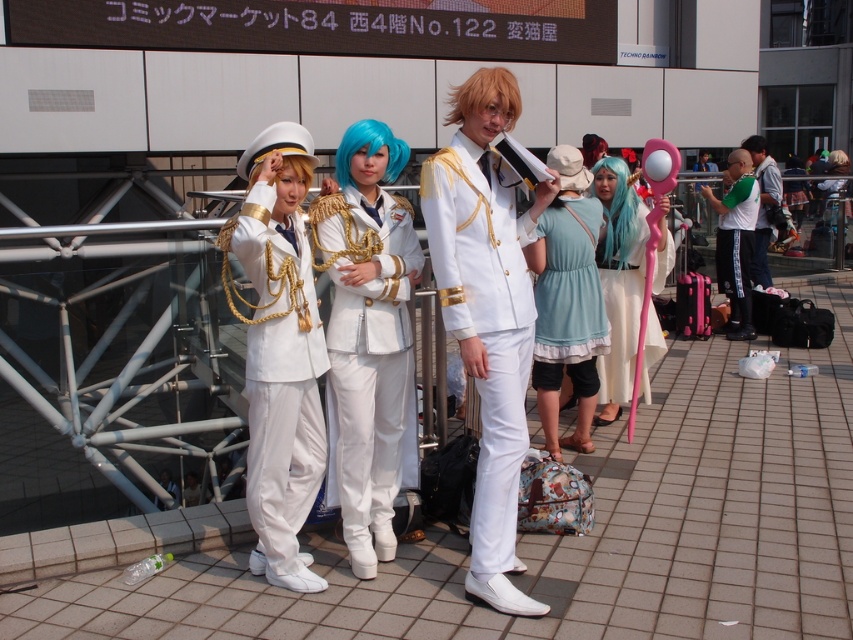
Is white satin uniform at center above white glossy uniform at right?

No.

Can you confirm if white satin uniform at center is taller than white glossy uniform at right?

Incorrect, white satin uniform at center's height is not larger of white glossy uniform at right's.

Which is in front, point (354, 449) or point (770, 163)?

Point (354, 449) is more forward.

Identify the location of white satin uniform at center. (369, 358).

Can you confirm if satin white uniform at center is positioned to the left of white glossy uniform at right?

Correct, you'll find satin white uniform at center to the left of white glossy uniform at right.

Which is behind, point (256, 384) or point (752, 148)?

The point (752, 148) is more distant.

Is point (260, 328) positioned behind point (759, 252)?

No.

At what (x,y) coordinates should I click in order to perform the action: click on satin white uniform at center. Please return your answer as a coordinate pair (x, y). This screenshot has width=853, height=640. Looking at the image, I should click on (280, 440).

Is white satin uniform at center positioned in front of satin white uniform at center?

That is False.

Can you confirm if white satin uniform at center is positioned to the left of satin white uniform at center?

Incorrect, white satin uniform at center is not on the left side of satin white uniform at center.

Locate an element on the screen. The width and height of the screenshot is (853, 640). white satin uniform at center is located at coordinates (369, 358).